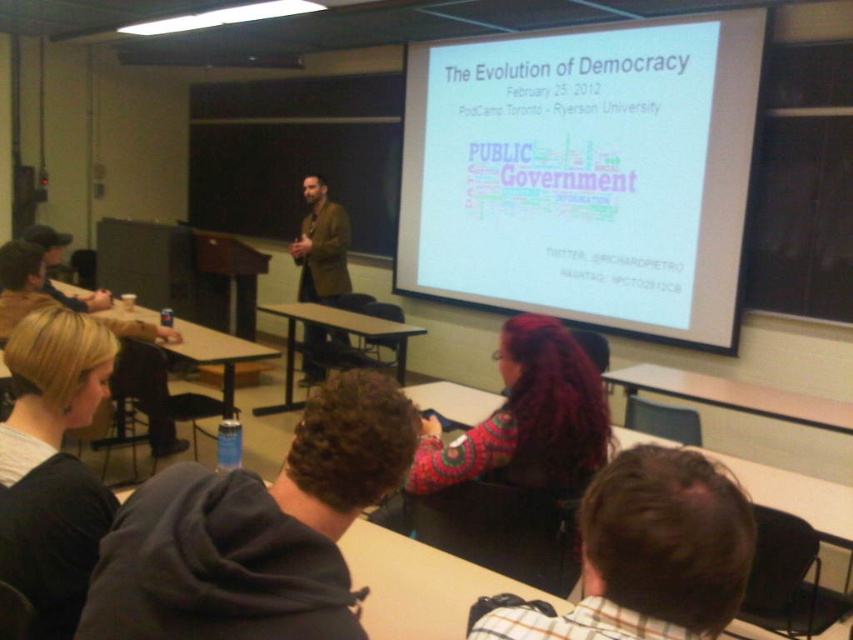
Question: Which of the following is the farthest from the observer?

Choices:
 (A) click(13, 524)
 (B) click(653, 67)
 (C) click(519, 314)
 (D) click(317, 330)

Answer: (D)

Question: Among these objects, which one is nearest to the camera?

Choices:
 (A) multicolored knitted sweater at center
 (B) white matte projection screen at upper center
 (C) brown leather jacket at center

Answer: (A)

Question: Is white matte projection screen at upper center to the right of brown leather jacket at center from the viewer's perspective?

Choices:
 (A) yes
 (B) no

Answer: (A)

Question: Which object appears farthest from the camera in this image?

Choices:
 (A) blonde hair at lower left
 (B) brown leather jacket at center
 (C) multicolored knitted sweater at center

Answer: (B)

Question: Can you confirm if white matte projection screen at upper center is positioned above multicolored knitted sweater at center?

Choices:
 (A) yes
 (B) no

Answer: (A)

Question: Can you confirm if blonde hair at lower left is positioned to the right of brown leather jacket at center?

Choices:
 (A) no
 (B) yes

Answer: (B)